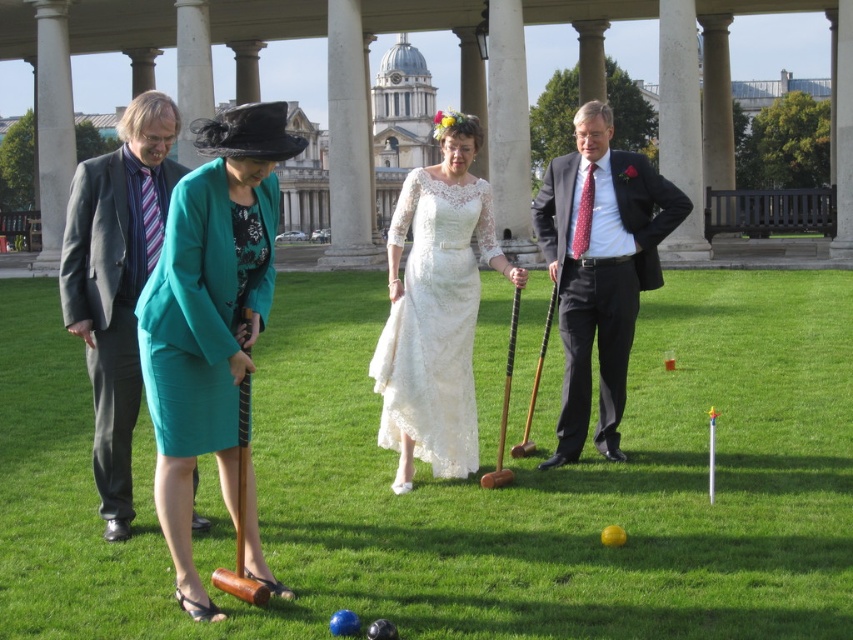
From the picture: Measure the distance between point (257,170) and camera.

34.49 meters

Who is more distant from viewer, (187, 218) or (625, 301)?

Positioned behind is point (625, 301).

Does point (201, 228) come in front of point (569, 200)?

Yes, point (201, 228) is closer to viewer.

Where is `teal fabric skirt at lower left`? teal fabric skirt at lower left is located at coordinates 212,326.

Does dark gray suit at right appear on the right side of lace/embroidered dress at center?

Yes, dark gray suit at right is to the right of lace/embroidered dress at center.

What do you see at coordinates (601, 268) in the screenshot? Image resolution: width=853 pixels, height=640 pixels. I see `dark gray suit at right` at bounding box center [601, 268].

Locate an element on the screen. The width and height of the screenshot is (853, 640). dark gray suit at right is located at coordinates (601, 268).

Can you confirm if gray suit at left is taller than lace/embroidered dress at center?

Indeed, gray suit at left has a greater height compared to lace/embroidered dress at center.

Measure the distance between point (94, 257) and camera.

Point (94, 257) is 38.64 meters from camera.

The image size is (853, 640). What do you see at coordinates (117, 282) in the screenshot?
I see `gray suit at left` at bounding box center [117, 282].

At what (x,y) coordinates should I click in order to perform the action: click on gray suit at left. Please return your answer as a coordinate pair (x, y). The height and width of the screenshot is (640, 853). Looking at the image, I should click on (117, 282).